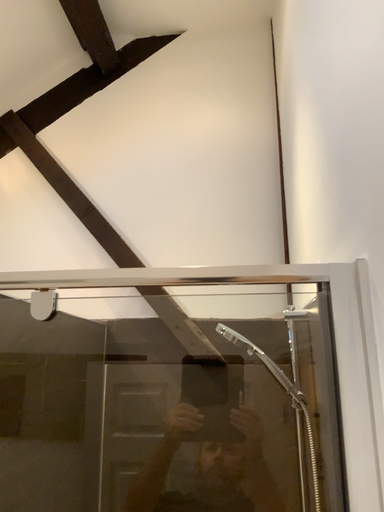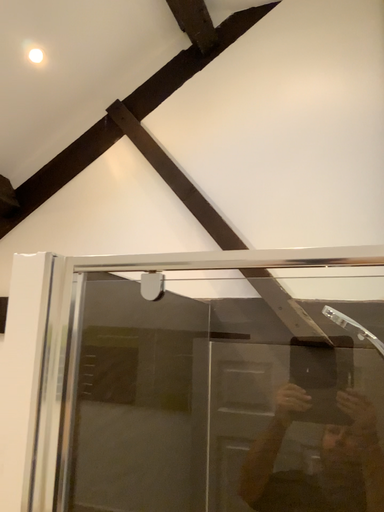
Question: Which way did the camera rotate in the video?

Choices:
 (A) rotated right
 (B) rotated left

Answer: (B)